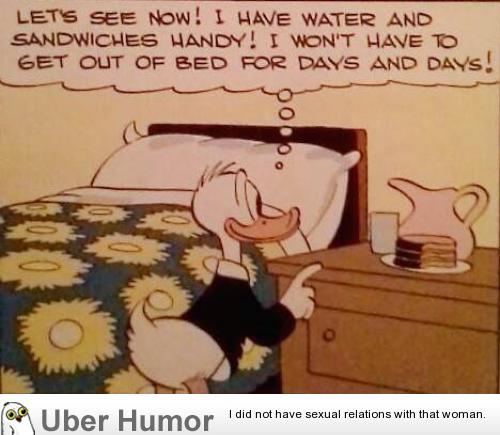
The height and width of the screenshot is (435, 500). Find the location of `pillow`. pillow is located at coordinates (170, 159).